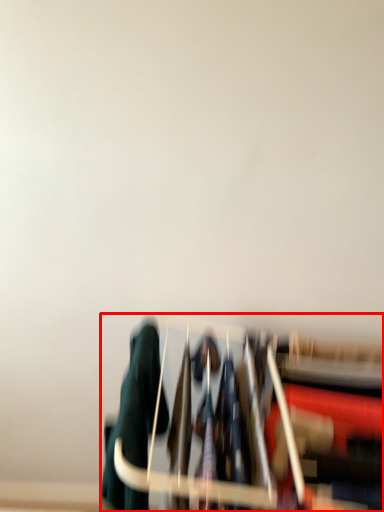
Question: In this image, where is furniture (annotated by the red box) located relative to clothing?

Choices:
 (A) left
 (B) right

Answer: (B)